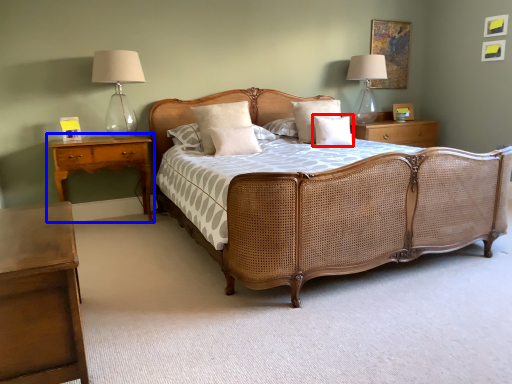
Question: Which point is further to the camera, pillow (highlighted by a red box) or nightstand (highlighted by a blue box)?

Choices:
 (A) pillow
 (B) nightstand

Answer: (A)